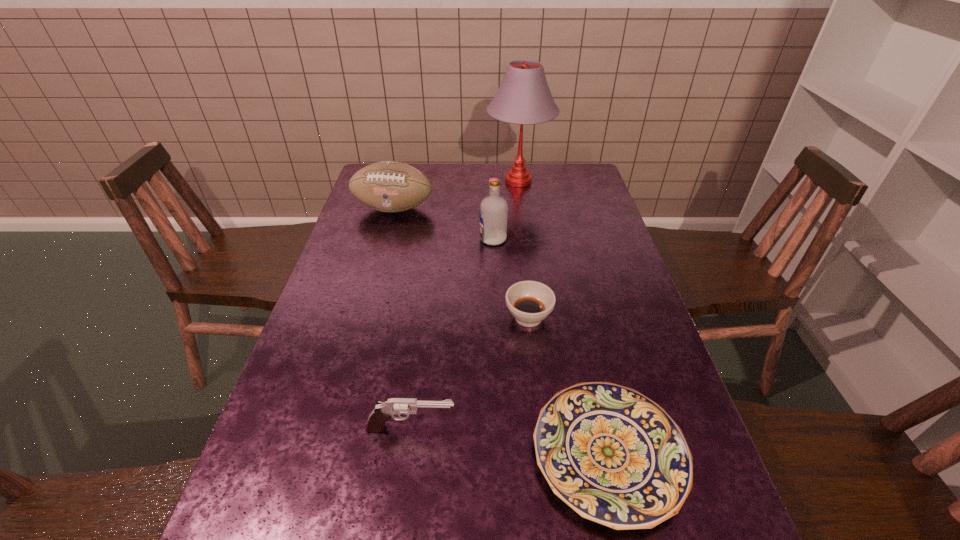
This screenshot has width=960, height=540. In order to click on vacant region that satisfies the following two spatial constraints: 1. on the laces of the football (American); 2. on the left side of the third nearest object in this screenshot , I will do `click(364, 318)`.